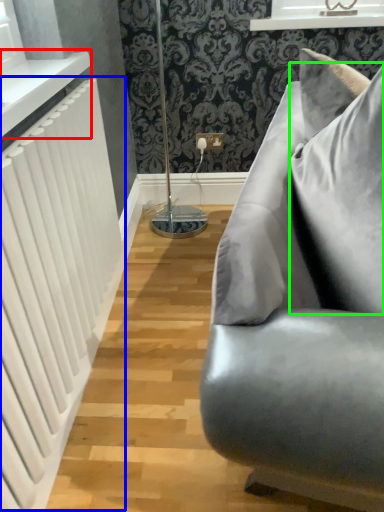
Question: Which object is the farthest from window sill (highlighted by a red box)? Choose among these: radiator (highlighted by a blue box) or pillow (highlighted by a green box).

Choices:
 (A) radiator
 (B) pillow

Answer: (B)